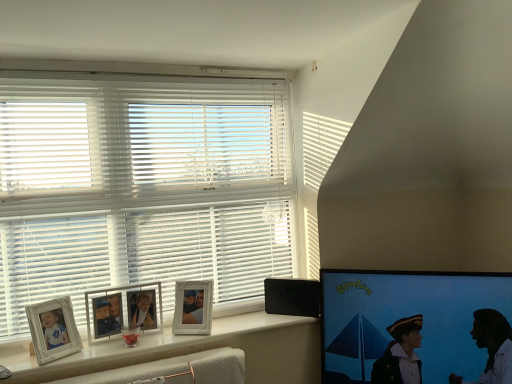
Find the location of `free point above white glossy window sill at lower left (from a real-world perspective)`. free point above white glossy window sill at lower left (from a real-world perspective) is located at coordinates (168, 336).